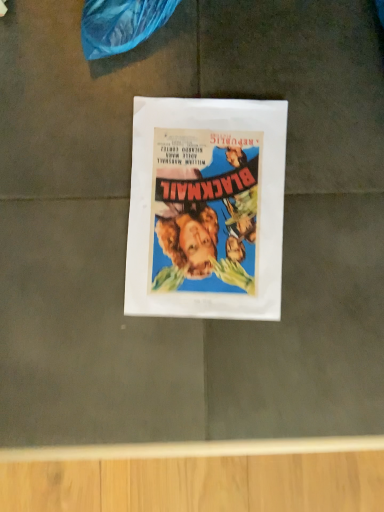
Question: Should I look upward or downward to see matte paper poster at center?

Choices:
 (A) down
 (B) up

Answer: (B)